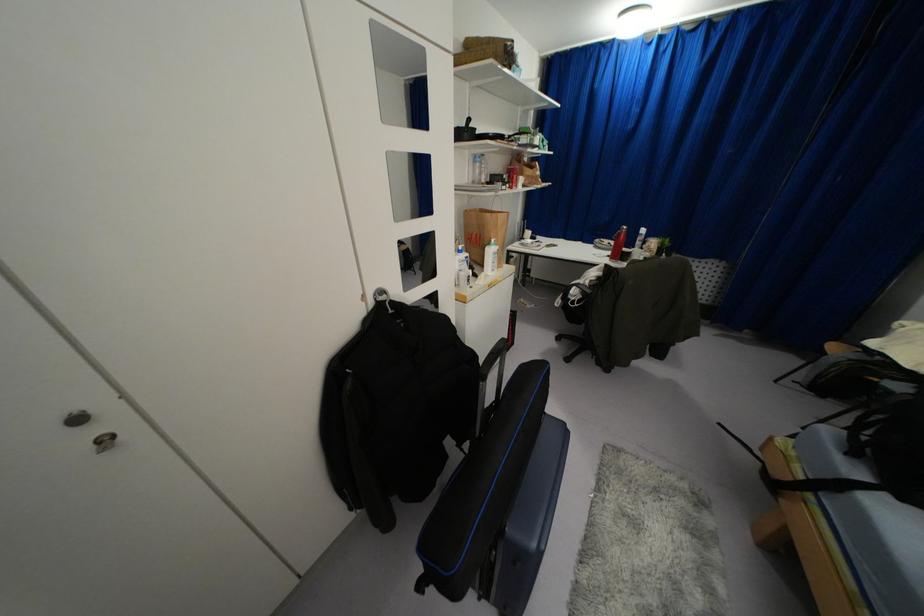
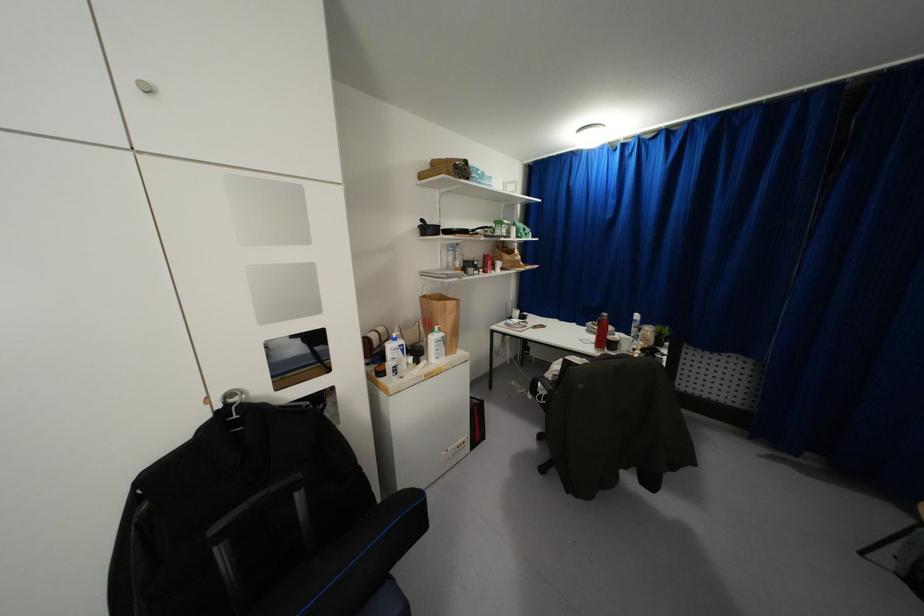
In the second image, find the point that corresponds to point (488, 214) in the first image.

(434, 302)